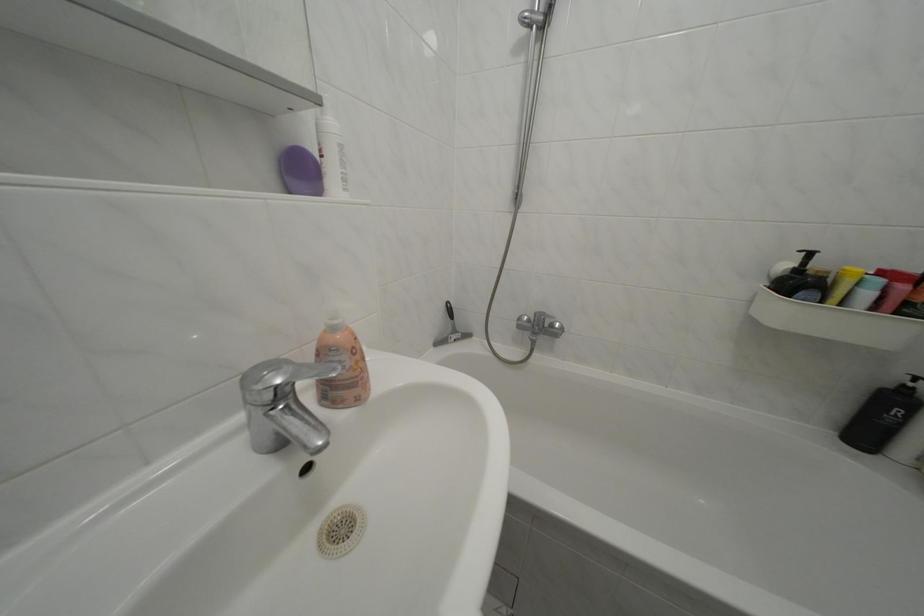
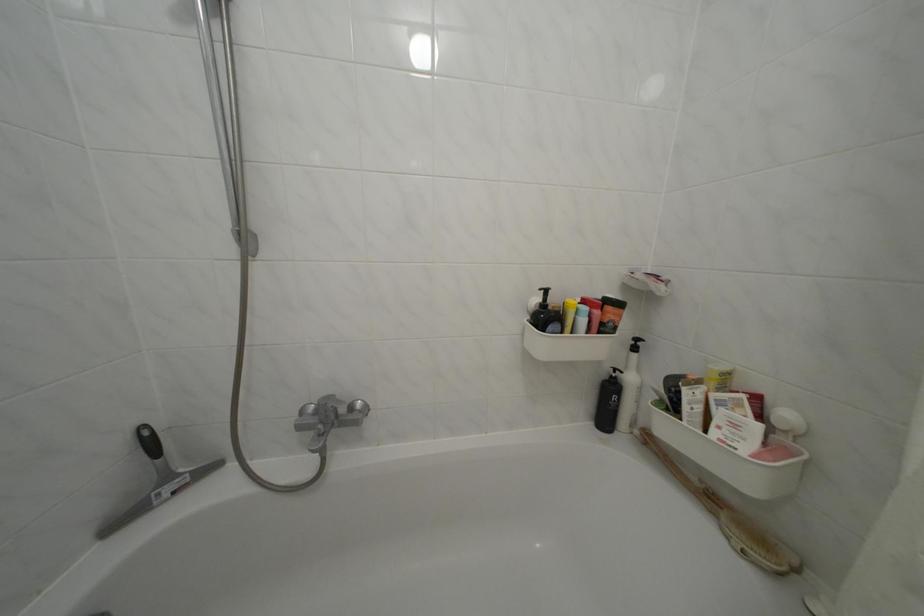
Locate, in the second image, the point that corresponds to the point at 538,331 in the first image.

(323, 426)